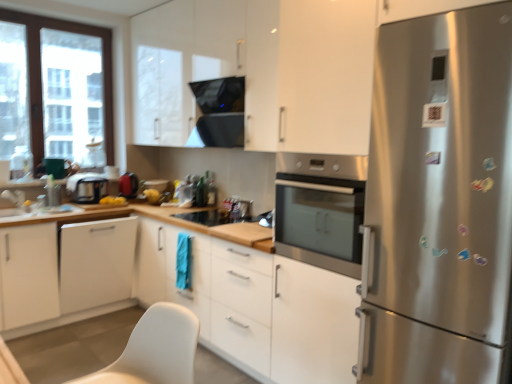
The image size is (512, 384). In order to click on free space above white glossy sink at lower left (from a real-world perspective) in this screenshot , I will do `click(12, 187)`.